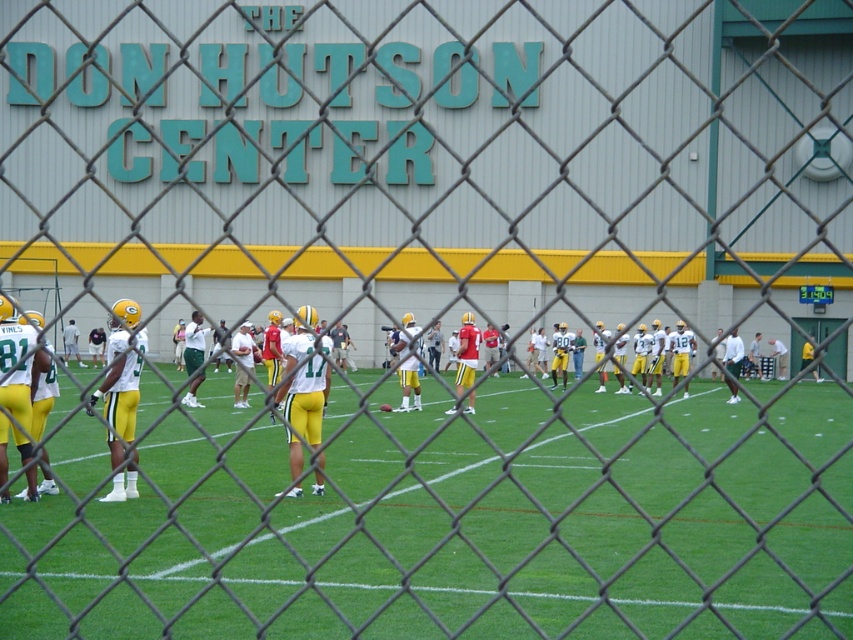
Is point (194, 429) more distant than point (743, 323)?

That is False.

Is yellow/yellow-green uniform at center closer to camera compared to matte green uniform at center?

That is False.

Who is more distant from viewer, (312,632) or (192,540)?

Point (312,632)

At what (x,y) coordinates should I click in order to perform the action: click on yellow/yellow-green uniform at center. Please return your answer as a coordinate pair (x, y). Image resolution: width=853 pixels, height=640 pixels. Looking at the image, I should click on (454, 522).